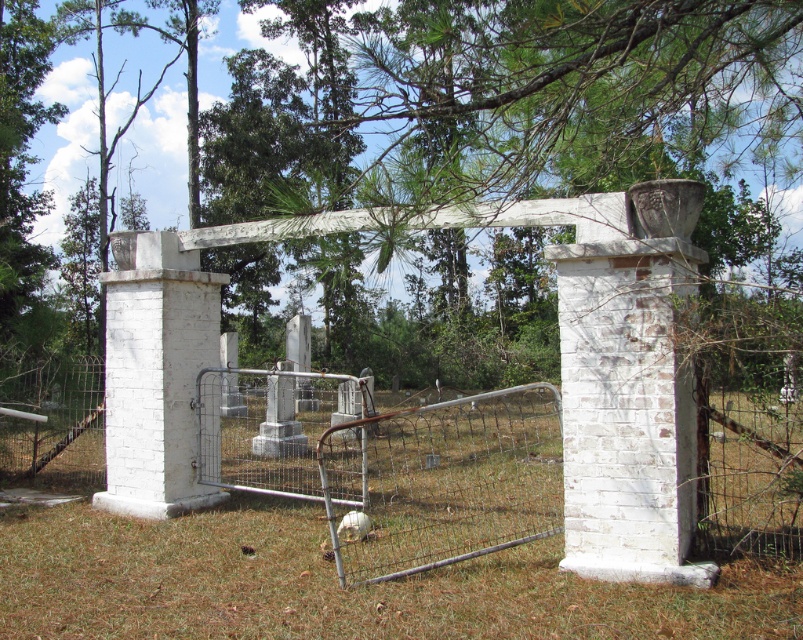
Question: Can you confirm if green leafy tree at upper center is wider than white painted brick gate at center?

Choices:
 (A) no
 (B) yes

Answer: (B)

Question: Which point is closer to the camera taking this photo?

Choices:
 (A) (636, 301)
 (B) (15, 202)

Answer: (A)

Question: Which object is farther from the camera taking this photo?

Choices:
 (A) brown dry grass at center
 (B) green leafy tree at upper center

Answer: (A)

Question: Observing the image, what is the correct spatial positioning of green leafy tree at upper center in reference to brown dry grass at center?

Choices:
 (A) right
 (B) left

Answer: (B)

Question: Which point is farther to the camera?

Choices:
 (A) green leafy tree at upper center
 (B) white painted brick gate at center
 (C) white painted brick column at center

Answer: (B)

Question: Does white painted brick column at center have a lesser width compared to white painted brick gate at center?

Choices:
 (A) yes
 (B) no

Answer: (A)